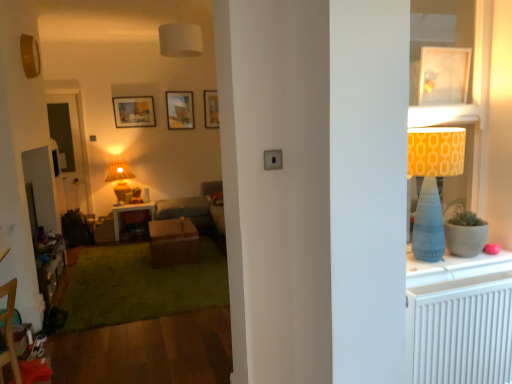
Question: Is white glossy picture frame at upper right, arranged as the first picture frame when viewed from the right, further to the viewer compared to wooden dresser at lower left?

Choices:
 (A) yes
 (B) no

Answer: (B)

Question: From the image's perspective, is white glossy picture frame at upper right, arranged as the first picture frame when viewed from the right, over wooden dresser at lower left?

Choices:
 (A) yes
 (B) no

Answer: (A)

Question: Does white glossy picture frame at upper right, the 1th picture frame in the front-to-back sequence, appear on the left side of wooden dresser at lower left?

Choices:
 (A) yes
 (B) no

Answer: (B)

Question: Can you confirm if white glossy picture frame at upper right, the 1th picture frame in the front-to-back sequence, is taller than wooden dresser at lower left?

Choices:
 (A) no
 (B) yes

Answer: (A)

Question: Considering the relative sizes of white glossy picture frame at upper right, the 1th picture frame in the front-to-back sequence, and wooden dresser at lower left in the image provided, is white glossy picture frame at upper right, the 1th picture frame in the front-to-back sequence, wider than wooden dresser at lower left?

Choices:
 (A) no
 (B) yes

Answer: (A)

Question: In the image, is white glossy picture frame at upper right, the 1th picture frame in the front-to-back sequence, on the left side or the right side of wooden picture frame at upper center, the 2th picture frame from the left?

Choices:
 (A) right
 (B) left

Answer: (A)

Question: Relative to wooden picture frame at upper center, arranged as the third picture frame when viewed from the right, is white glossy picture frame at upper right, the 1th picture frame in the front-to-back sequence, in front or behind?

Choices:
 (A) front
 (B) behind

Answer: (A)

Question: Is white glossy picture frame at upper right, arranged as the first picture frame when viewed from the right, spatially inside wooden picture frame at upper center, the 2th picture frame from the left, or outside of it?

Choices:
 (A) inside
 (B) outside

Answer: (B)

Question: In terms of size, does white glossy picture frame at upper right, the 4th picture frame from the left, appear bigger or smaller than wooden picture frame at upper center, the 3th picture frame viewed from the front?

Choices:
 (A) small
 (B) big

Answer: (A)

Question: Considering the positions of point (76, 100) and point (456, 130), is point (76, 100) closer or farther from the camera than point (456, 130)?

Choices:
 (A) closer
 (B) farther

Answer: (B)

Question: From a real-world perspective, relative to matte blue cone-shaped lampshade at right, which is the third lamp from left to right, is transparent glass door at left vertically above or below?

Choices:
 (A) above
 (B) below

Answer: (B)

Question: Is transparent glass door at left bigger or smaller than matte blue cone-shaped lampshade at right, the first lamp in the bottom-to-top sequence?

Choices:
 (A) big
 (B) small

Answer: (A)

Question: Is transparent glass door at left inside or outside of matte blue cone-shaped lampshade at right, which ranks as the 3th lamp in back-to-front order?

Choices:
 (A) outside
 (B) inside

Answer: (A)

Question: Considering the positions of point (432, 233) and point (206, 105), is point (432, 233) closer or farther from the camera than point (206, 105)?

Choices:
 (A) farther
 (B) closer

Answer: (B)

Question: From a real-world perspective, relative to wooden picture frame at upper center, which is counted as the 2th picture frame, starting from the right, is matte blue cone-shaped lampshade at right, which is the first lamp in right-to-left order, vertically above or below?

Choices:
 (A) below
 (B) above

Answer: (A)